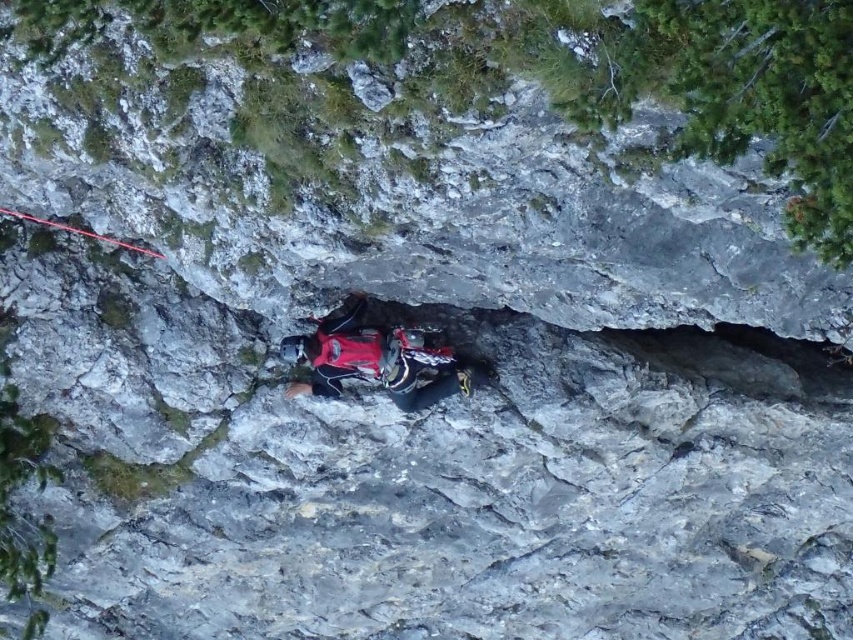
Question: Does red fabric harness at center have a larger size compared to red nylon rope at upper left?

Choices:
 (A) yes
 (B) no

Answer: (A)

Question: Which point appears closest to the camera in this image?

Choices:
 (A) (3, 209)
 (B) (408, 388)

Answer: (A)

Question: Does red fabric harness at center appear over red nylon rope at upper left?

Choices:
 (A) no
 (B) yes

Answer: (A)

Question: From the image, what is the correct spatial relationship of red fabric harness at center in relation to red nylon rope at upper left?

Choices:
 (A) below
 (B) above

Answer: (A)